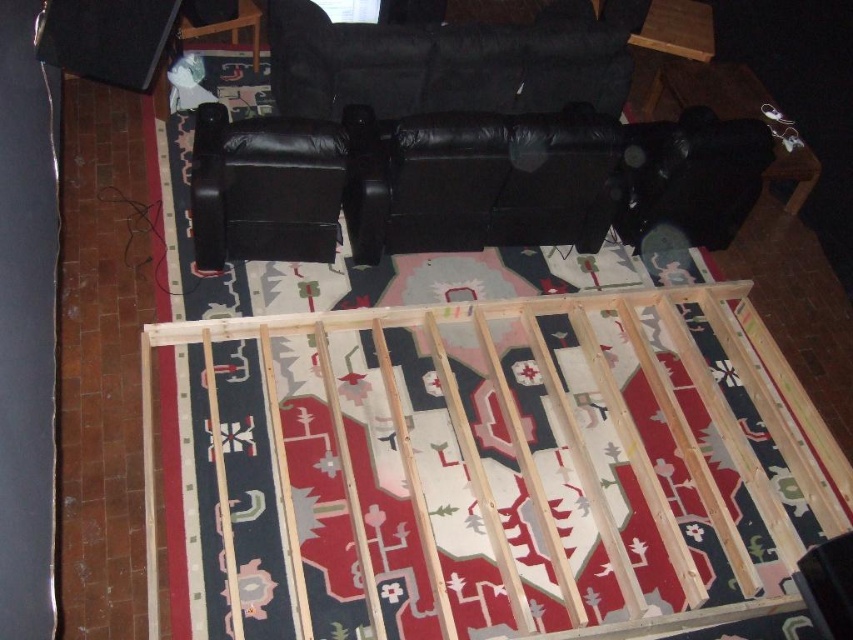
Question: Is black leather couch at center bigger than black leather couch at upper center?

Choices:
 (A) yes
 (B) no

Answer: (B)

Question: Which of the following is the closest to the observer?

Choices:
 (A) black leather couch at upper center
 (B) black leather armchair at upper center
 (C) black leather couch at center

Answer: (B)

Question: Based on their relative distances, which object is farther from the black leather armchair at upper center?

Choices:
 (A) black leather couch at upper center
 (B) black leather couch at center

Answer: (A)

Question: Is black leather armchair at upper center to the right of black leather couch at upper center from the viewer's perspective?

Choices:
 (A) no
 (B) yes

Answer: (A)

Question: Is black leather couch at center thinner than black leather armchair at upper center?

Choices:
 (A) yes
 (B) no

Answer: (B)

Question: Which of the following is the closest to the observer?

Choices:
 (A) (271, 208)
 (B) (720, 74)

Answer: (A)